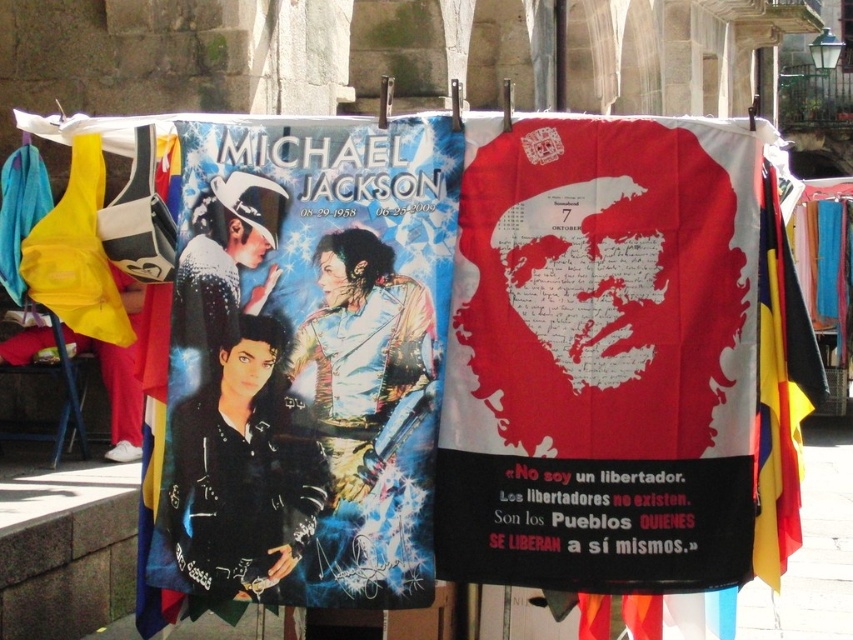
Question: Is shiny metallic poster at left closer to the viewer compared to matte blue fabric at left?

Choices:
 (A) no
 (B) yes

Answer: (B)

Question: Which of the following is the farthest from the observer?

Choices:
 (A) 164,225
 (B) 181,532
 (C) 3,182
 (D) 44,272

Answer: (C)

Question: Which point is farther to the camera?

Choices:
 (A) red matte poster at center
 (B) matte blue fabric at left
 (C) yellow fabric at left

Answer: (B)

Question: In this image, where is yellow fabric flag at right located relative to yellow fabric at left?

Choices:
 (A) left
 (B) right

Answer: (B)

Question: Which object is positioned farthest from the red matte poster at center?

Choices:
 (A) white fabric at left
 (B) metallic reflective poster at center

Answer: (A)

Question: Is red matte poster at center below white fabric at left?

Choices:
 (A) yes
 (B) no

Answer: (A)